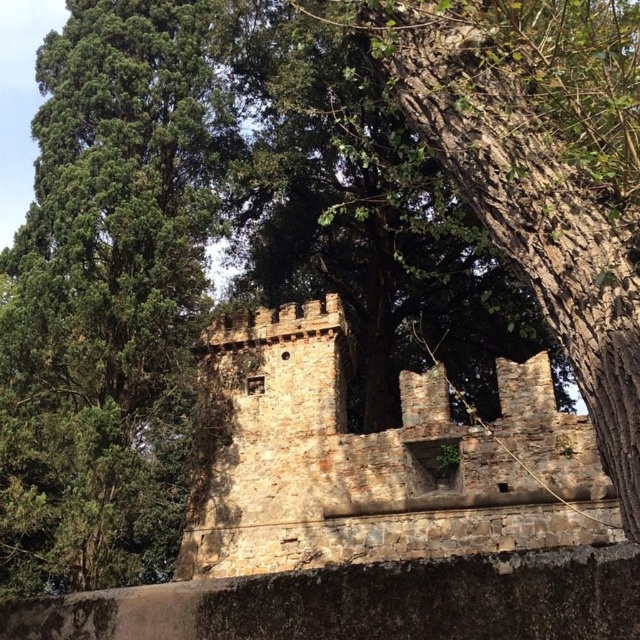
Is point (81, 330) positioned before point (436, 369)?

Yes, it is in front of point (436, 369).

Between point (42, 186) and point (323, 369), which one is positioned in front?

Point (323, 369) is in front.

Locate an element on the screen. This screenshot has width=640, height=640. green leafy tree at center is located at coordinates (108, 296).

The height and width of the screenshot is (640, 640). What are the coordinates of `green leafy tree at center` in the screenshot? It's located at (108, 296).